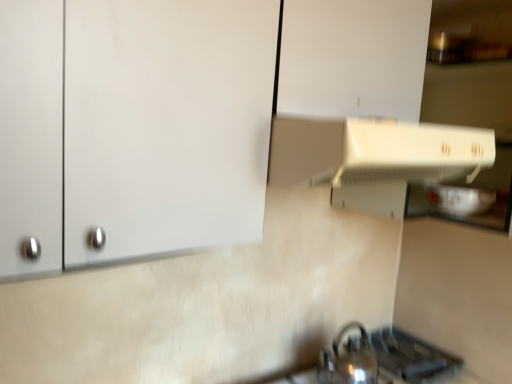
Question: Are white matte cabinet at upper left and metallic silver gas stove at lower right far apart?

Choices:
 (A) yes
 (B) no

Answer: (B)

Question: Is white matte cabinet at upper left bigger than metallic silver gas stove at lower right?

Choices:
 (A) yes
 (B) no

Answer: (A)

Question: From a real-world perspective, is white matte cabinet at upper left physically below metallic silver gas stove at lower right?

Choices:
 (A) no
 (B) yes

Answer: (A)

Question: Is white matte cabinet at upper left at the left side of metallic silver gas stove at lower right?

Choices:
 (A) yes
 (B) no

Answer: (A)

Question: Is white matte cabinet at upper left in contact with metallic silver gas stove at lower right?

Choices:
 (A) yes
 (B) no

Answer: (B)

Question: Considering their positions, is white matte cabinet at upper left located in front of or behind shiny metallic tea pot at lower right?

Choices:
 (A) behind
 (B) front

Answer: (B)

Question: From the image's perspective, is white matte cabinet at upper left positioned above or below shiny metallic tea pot at lower right?

Choices:
 (A) above
 (B) below

Answer: (A)

Question: Is point (259, 144) positioned closer to the camera than point (369, 350)?

Choices:
 (A) closer
 (B) farther

Answer: (A)

Question: From their relative heights in the image, would you say white matte cabinet at upper left is taller or shorter than shiny metallic tea pot at lower right?

Choices:
 (A) short
 (B) tall

Answer: (B)

Question: In terms of width, does metallic silver gas stove at lower right look wider or thinner when compared to white matte cabinet at upper left?

Choices:
 (A) wide
 (B) thin

Answer: (B)

Question: Is metallic silver gas stove at lower right taller or shorter than white matte cabinet at upper left?

Choices:
 (A) short
 (B) tall

Answer: (A)

Question: Looking at the image, does metallic silver gas stove at lower right seem bigger or smaller compared to white matte cabinet at upper left?

Choices:
 (A) big
 (B) small

Answer: (B)

Question: In the image, is metallic silver gas stove at lower right on the left side or the right side of white matte cabinet at upper left?

Choices:
 (A) left
 (B) right

Answer: (B)

Question: From the image's perspective, relative to metallic silver gas stove at lower right, is white matte cabinet at upper left above or below?

Choices:
 (A) above
 (B) below

Answer: (A)

Question: Would you say white matte cabinet at upper left is inside or outside metallic silver gas stove at lower right?

Choices:
 (A) inside
 (B) outside

Answer: (B)